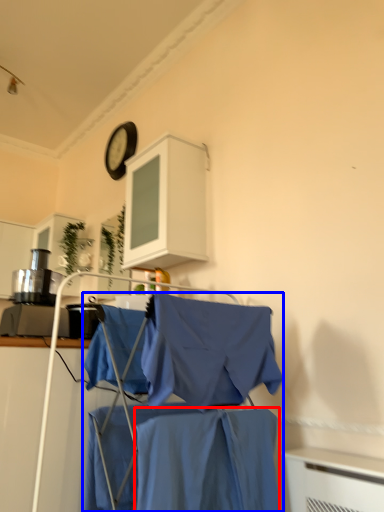
Question: Which point is closer to the camera, fabric (highlighted by a red box) or laundry (highlighted by a blue box)?

Choices:
 (A) fabric
 (B) laundry

Answer: (A)